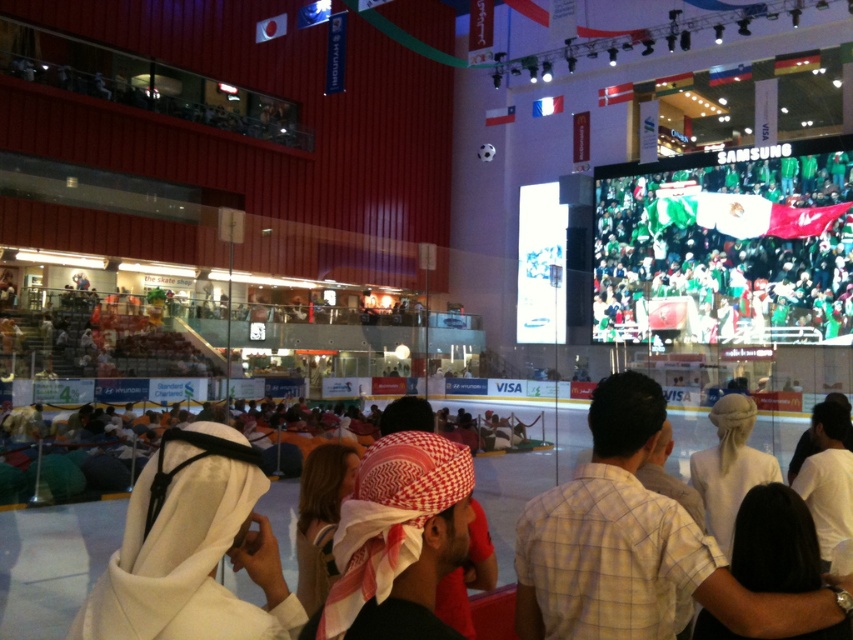
You are a photographer planning to take a group photo of the light brown checkered shirt at center and the red checkered headscarf at center. If you want to ensure both subjects are fully visible in the frame, which subject should you adjust the camera focus to prioritize based on their sizes?

The light brown checkered shirt at center has a larger width than the red checkered headscarf at center, so you should prioritize focusing on the light brown checkered shirt at center to ensure it fits well within the frame.

You are a photographer at the event and want to capture both the light brown checkered shirt at center and the red checkered headscarf at center in the same frame. Which object should you focus on first to ensure both are in the frame?

The light brown checkered shirt at center is taller than the red checkered headscarf at center, so you should focus on the light brown checkered shirt at center first to ensure both are in the frame.

You are a photographer standing at the front of the venue and want to take a photo that includes both the green fabric crowd at upper center and the red checkered headscarf at center. Which object should you focus on first to ensure both are in the frame?

The green fabric crowd at upper center is closer to you than the red checkered headscarf at center, so you should focus on the green fabric crowd at upper center first to ensure both are in the frame.